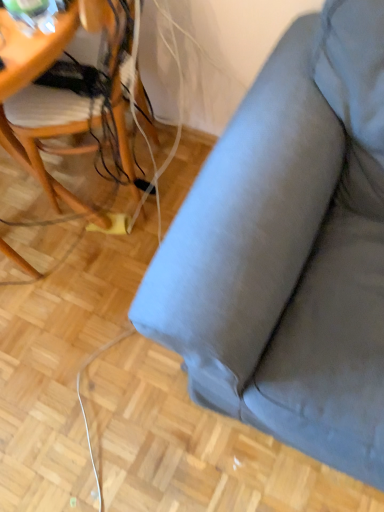
Question: Would you say matte gray fabric couch at upper right is inside or outside woodenchair at left?

Choices:
 (A) outside
 (B) inside

Answer: (A)

Question: Considering the relative positions of matte gray fabric couch at upper right and woodenchair at left in the image provided, is matte gray fabric couch at upper right to the left or to the right of woodenchair at left?

Choices:
 (A) right
 (B) left

Answer: (A)

Question: Is point (283, 423) positioned closer to the camera than point (89, 15)?

Choices:
 (A) closer
 (B) farther

Answer: (A)

Question: In terms of height, does woodenchair at left look taller or shorter compared to matte gray fabric couch at upper right?

Choices:
 (A) tall
 (B) short

Answer: (B)

Question: Is point (72, 124) closer or farther from the camera than point (337, 399)?

Choices:
 (A) closer
 (B) farther

Answer: (B)

Question: In terms of width, does woodenchair at left look wider or thinner when compared to matte gray fabric couch at upper right?

Choices:
 (A) thin
 (B) wide

Answer: (A)

Question: Is woodenchair at left bigger or smaller than matte gray fabric couch at upper right?

Choices:
 (A) small
 (B) big

Answer: (A)